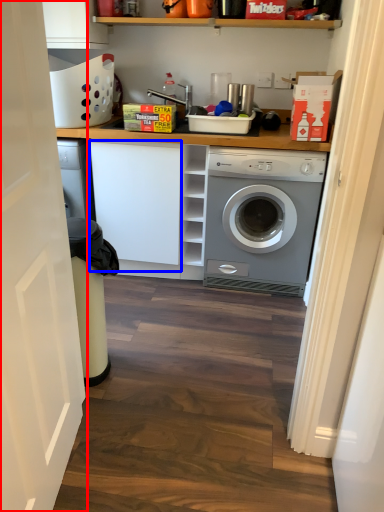
Question: Which object is closer to the camera taking this photo, door (highlighted by a red box) or cabinetry (highlighted by a blue box)?

Choices:
 (A) door
 (B) cabinetry

Answer: (A)